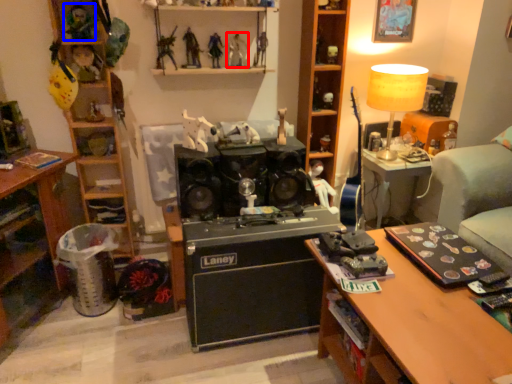
Question: Which object appears farthest to the camera in this image, toy (highlighted by a red box) or toy (highlighted by a blue box)?

Choices:
 (A) toy
 (B) toy

Answer: (A)